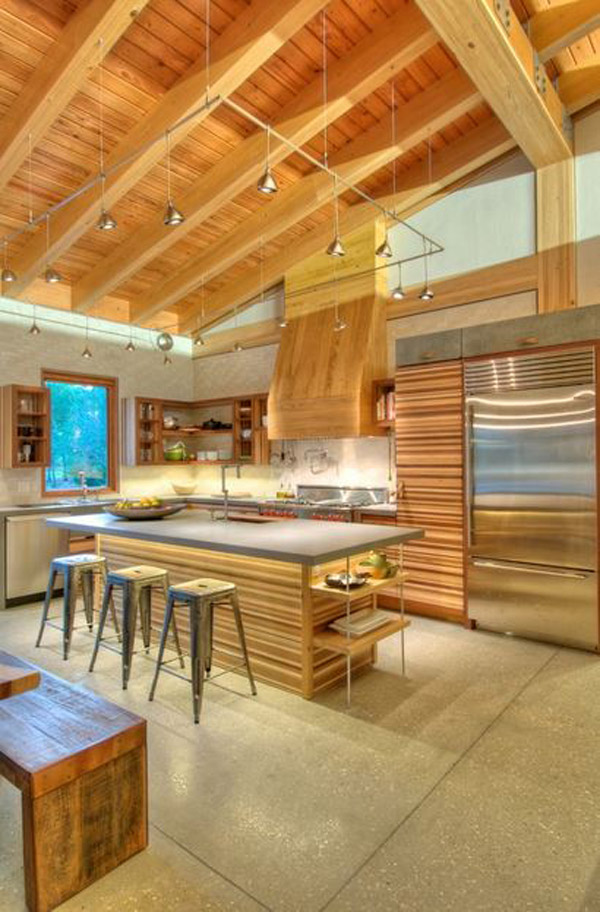
Where is `kitchen table`? kitchen table is located at coordinates (272, 533).